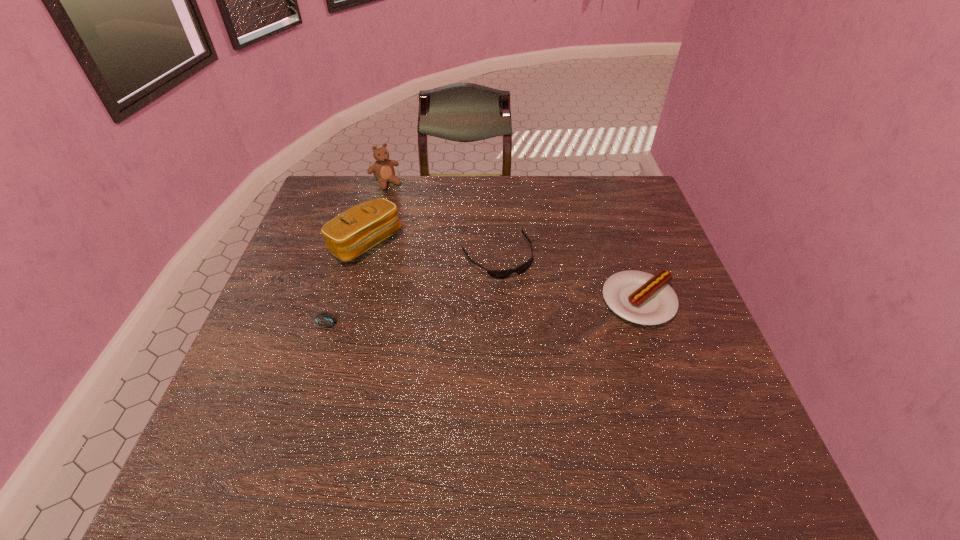
I want to click on mouse at the left edge, so click(x=325, y=319).

You are a GUI agent. You are given a task and a screenshot of the screen. Output one action in this format:
    pyautogui.click(x=<x>, y=<y>)
    Task: Click on the clutch bag that is at the left edge
    This screenshot has width=960, height=540.
    Given the screenshot: What is the action you would take?
    pyautogui.click(x=360, y=228)

Locate an element on the screen. teddy bear positioned at the left edge is located at coordinates (383, 169).

At what (x,y) coordinates should I click in order to perform the action: click on object present at the right edge. Please return your answer as a coordinate pair (x, y). This screenshot has height=540, width=960. Looking at the image, I should click on (639, 297).

Find the location of `object that is positioned at the far left corner`. object that is positioned at the far left corner is located at coordinates (383, 169).

Identify the location of vacant space at the far edge. [x=473, y=182].

You are a GUI agent. You are given a task and a screenshot of the screen. Output one action in this format:
    pyautogui.click(x=<x>, y=<y>)
    Task: Click on the free space at the left edge of the desktop
    The height and width of the screenshot is (540, 960).
    Given the screenshot: What is the action you would take?
    pyautogui.click(x=290, y=314)

Where is `free spot at the far left corner of the desktop`? The image size is (960, 540). free spot at the far left corner of the desktop is located at coordinates (334, 211).

In the image, there is a desktop. Identify the location of free region at the far right corner. (652, 212).

This screenshot has height=540, width=960. Find the location of `vacant space at the near right corner`. vacant space at the near right corner is located at coordinates (681, 403).